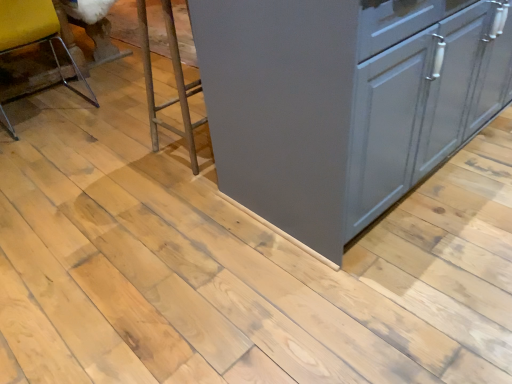
At what (x,y) coordinates should I click in order to perform the action: click on free space that is to the left of metallic silver step stool at center. Please return your answer as a coordinate pair (x, y). Looking at the image, I should click on (135, 155).